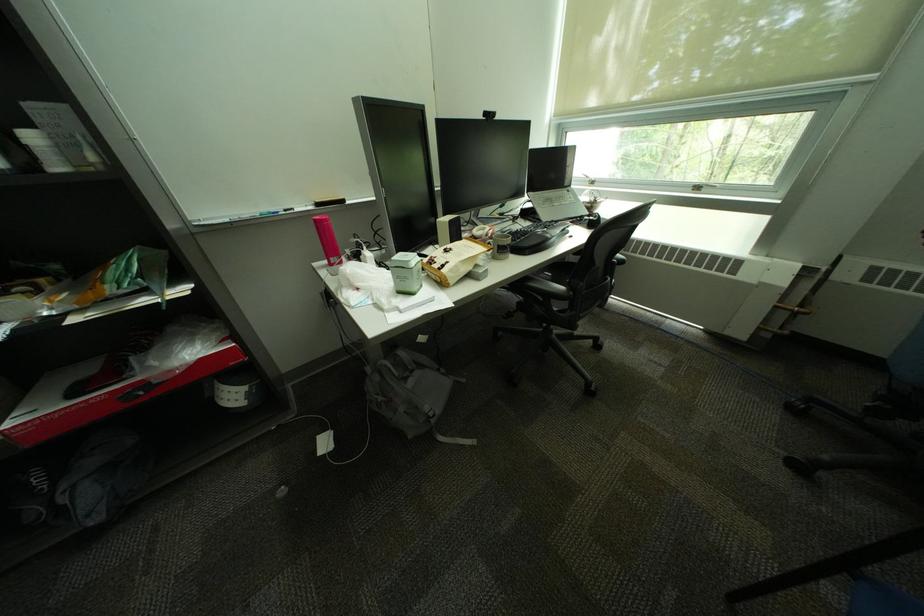
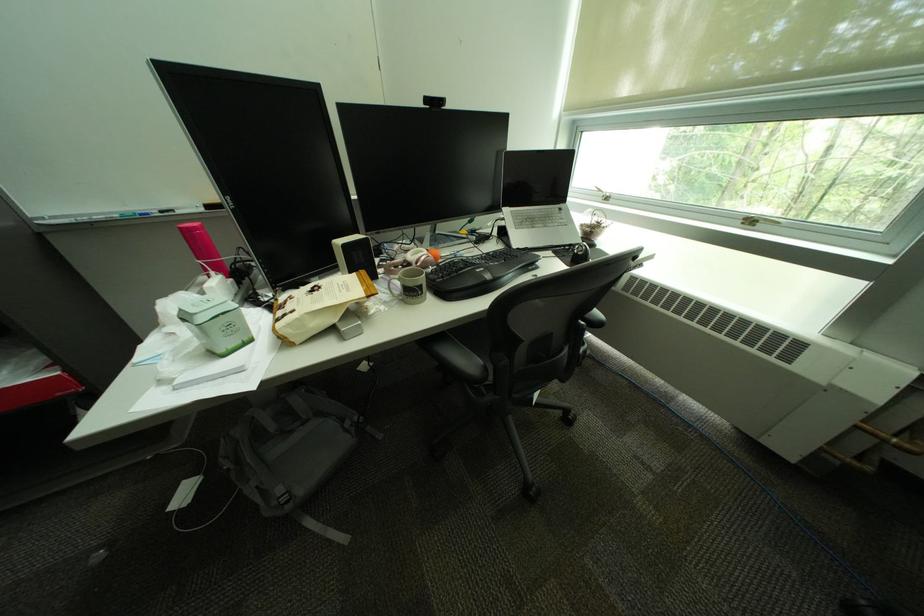
Where in the second image is the point corresponding to point 709,190 from the first image?

(761, 224)